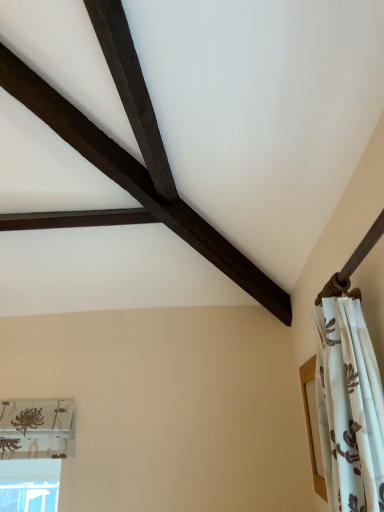
Question: Would you say white floral fabric curtain at right is to the left or to the right of transparent glass window at lower left in the picture?

Choices:
 (A) right
 (B) left

Answer: (A)

Question: From their relative heights in the image, would you say white floral fabric curtain at right is taller or shorter than transparent glass window at lower left?

Choices:
 (A) short
 (B) tall

Answer: (B)

Question: Is white floral fabric curtain at right wider or thinner than transparent glass window at lower left?

Choices:
 (A) wide
 (B) thin

Answer: (B)

Question: From the image's perspective, is transparent glass window at lower left located above or below white floral fabric curtain at right?

Choices:
 (A) above
 (B) below

Answer: (B)

Question: Relative to white floral fabric curtain at right, is transparent glass window at lower left in front or behind?

Choices:
 (A) front
 (B) behind

Answer: (B)

Question: Would you say transparent glass window at lower left is to the left or to the right of white floral fabric curtain at right in the picture?

Choices:
 (A) left
 (B) right

Answer: (A)

Question: Do you think transparent glass window at lower left is within white floral fabric curtain at right, or outside of it?

Choices:
 (A) inside
 (B) outside

Answer: (B)